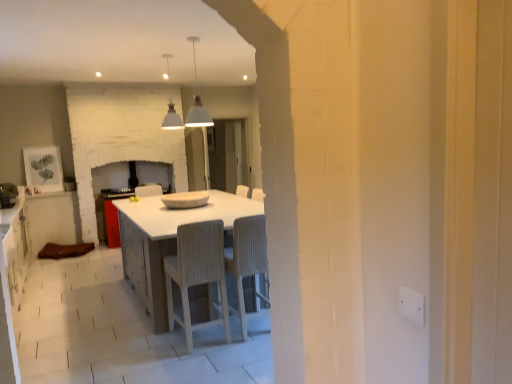
Image resolution: width=512 pixels, height=384 pixels. Describe the element at coordinates (411, 305) in the screenshot. I see `white plastic electric outlet at right` at that location.

In order to face white matte pendant lights at upper center, the first light fixture when ordered from right to left, should I rotate leftwards or rightwards?

It's best to rotate left around 7.794 degrees.

This screenshot has width=512, height=384. What do you see at coordinates (8, 195) in the screenshot?
I see `brushed metal oven at left` at bounding box center [8, 195].

The image size is (512, 384). What are the coordinates of `white glossy table at center` in the screenshot? It's located at (166, 241).

Describe the element at coordinates (52, 220) in the screenshot. I see `matte brown cabinet at left` at that location.

This screenshot has height=384, width=512. I want to click on velvet beige armchair at center, so click(151, 184).

How far apart are white matte pendant lights at upper center, which is the 2th light fixture from left to right, and white ribbed chair at center, the first chair in the left-to-right sequence?

white matte pendant lights at upper center, which is the 2th light fixture from left to right, is 1.47 meters from white ribbed chair at center, the first chair in the left-to-right sequence.

Is white matte pendant lights at upper center, the first light fixture when ordered from right to left, wider than white ribbed chair at center, placed as the second chair when sorted from right to left?

No.

Is white matte pendant lights at upper center, marked as the second light fixture in a back-to-front arrangement, located outside white ribbed chair at center, the first chair in the left-to-right sequence?

That's correct, white matte pendant lights at upper center, marked as the second light fixture in a back-to-front arrangement, is outside of white ribbed chair at center, the first chair in the left-to-right sequence.

Would you say white matte pendant lights at upper center, which is the 1th light fixture from front to back, is to the left or to the right of white ribbed chair at center, the first chair in the left-to-right sequence, in the picture?

white matte pendant lights at upper center, which is the 1th light fixture from front to back, is positioned on white ribbed chair at center, the first chair in the left-to-right sequence,'s left side.

Could you tell me if white glossy table at center is facing white textured chair at center, the second chair from the left?

No, white glossy table at center is not turned towards white textured chair at center, the second chair from the left.

Which object is further away from the camera, white glossy table at center or white textured chair at center, marked as the first chair in a right-to-left arrangement?

white textured chair at center, marked as the first chair in a right-to-left arrangement, is more distant.

From the image's perspective, would you say white glossy table at center is shown under white textured chair at center, marked as the first chair in a right-to-left arrangement?

Incorrect, from the image's perspective, white glossy table at center is higher than white textured chair at center, marked as the first chair in a right-to-left arrangement.

Which is less distant, [170,232] or [260,259]?

Point [170,232] is positioned closer to the camera compared to point [260,259].

Locate an element on the screen. Image resolution: width=512 pixels, height=384 pixels. appliance lying behind the white textured chair at center, the second chair from the left is located at coordinates (8, 195).

From the image's perspective, would you say white textured chair at center, marked as the first chair in a right-to-left arrangement, is positioned over brushed metal oven at left?

Actually, white textured chair at center, marked as the first chair in a right-to-left arrangement, appears below brushed metal oven at left in the image.

Which is further, [250,217] or [14,188]?

The point [14,188] is farther from the camera.

In the scene shown: How different are the orientations of white ribbed chair at center, placed as the second chair when sorted from right to left, and matte brown cabinet at left in degrees?

The facing directions of white ribbed chair at center, placed as the second chair when sorted from right to left, and matte brown cabinet at left are 180 degrees apart.

Is white ribbed chair at center, the first chair in the left-to-right sequence, oriented away from matte brown cabinet at left?

No.

Do you think white ribbed chair at center, the first chair in the left-to-right sequence, is within matte brown cabinet at left, or outside of it?

white ribbed chair at center, the first chair in the left-to-right sequence, is outside matte brown cabinet at left.

Is there a large distance between white ribbed chair at center, placed as the second chair when sorted from right to left, and matte brown cabinet at left?

white ribbed chair at center, placed as the second chair when sorted from right to left, is positioned a significant distance from matte brown cabinet at left.

Is white textured chair at center, marked as the first chair in a right-to-left arrangement, placed right next to velvet beige armchair at center?

white textured chair at center, marked as the first chair in a right-to-left arrangement, is not next to velvet beige armchair at center, and they're not touching.

Considering the positions of point (229, 271) and point (158, 183), is point (229, 271) closer or farther from the camera than point (158, 183)?

Point (229, 271).

From the image's perspective, relative to velvet beige armchair at center, is white textured chair at center, marked as the first chair in a right-to-left arrangement, above or below?

white textured chair at center, marked as the first chair in a right-to-left arrangement, is below velvet beige armchair at center.

Can you confirm if white glossy table at center is taller than velvet beige armchair at center?

Correct, white glossy table at center is much taller as velvet beige armchair at center.

Between white glossy table at center and velvet beige armchair at center, which one has smaller size?

With smaller size is velvet beige armchair at center.

From the image's perspective, which one is positioned lower, white glossy table at center or velvet beige armchair at center?

white glossy table at center is shown below in the image.

Is point (176, 242) positioned in front of point (151, 183)?

Yes, it is in front of point (151, 183).

How far apart are white textured chair at center, the second chair from the left, and white glossy table at center?

white textured chair at center, the second chair from the left, is 28.23 inches from white glossy table at center.

Does white textured chair at center, marked as the first chair in a right-to-left arrangement, turn towards white glossy table at center?

Yes, white textured chair at center, marked as the first chair in a right-to-left arrangement, is aimed at white glossy table at center.

Is the surface of white textured chair at center, the second chair from the left, in direct contact with white glossy table at center?

No.

Who is smaller, white textured chair at center, the second chair from the left, or white glossy table at center?

Smaller between the two is white textured chair at center, the second chair from the left.

Where is `the 1st chair counting from the right side of the white matte pendant lights at upper center, marked as the second light fixture in a back-to-front arrangement`? the 1st chair counting from the right side of the white matte pendant lights at upper center, marked as the second light fixture in a back-to-front arrangement is located at coordinates (197, 272).

Where is `table that is in front of the white textured chair at center, the second chair from the left`? The width and height of the screenshot is (512, 384). table that is in front of the white textured chair at center, the second chair from the left is located at coordinates (166, 241).

Based on their spatial positions, is brushed metal oven at left or white matte pendant light at upper center, the 1th light fixture when ordered from back to front, further from white glossy table at center?

brushed metal oven at left.

Considering their positions, is white ribbed chair at center, the first chair in the left-to-right sequence, positioned closer to white textured chair at center, marked as the first chair in a right-to-left arrangement, than white matte pendant lights at upper center, marked as the second light fixture in a back-to-front arrangement?

white ribbed chair at center, the first chair in the left-to-right sequence, is positioned closer to the anchor white textured chair at center, marked as the first chair in a right-to-left arrangement.

From the image, which object appears to be farther from white plastic electric outlet at right, white textured chair at center, marked as the first chair in a right-to-left arrangement, or white matte pendant light at upper center, arranged as the second light fixture when viewed from the front?

white matte pendant light at upper center, arranged as the second light fixture when viewed from the front, is positioned further to the anchor white plastic electric outlet at right.

From the image, which object appears to be farther from white ribbed chair at center, placed as the second chair when sorted from right to left, white textured chair at center, marked as the first chair in a right-to-left arrangement, or matte brown cabinet at left?

matte brown cabinet at left is further to white ribbed chair at center, placed as the second chair when sorted from right to left.

Which object lies nearer to the anchor point white plastic electric outlet at right, brushed metal oven at left or white textured chair at center, the second chair from the left?

white textured chair at center, the second chair from the left.

From the image, which object appears to be nearer to white matte pendant light at upper center, the 1th light fixture when ordered from back to front, white ribbed chair at center, placed as the second chair when sorted from right to left, or matte brown cabinet at left?

The object closer to white matte pendant light at upper center, the 1th light fixture when ordered from back to front, is white ribbed chair at center, placed as the second chair when sorted from right to left.

From the image, which object appears to be farther from matte brown cabinet at left, white ribbed chair at center, the first chair in the left-to-right sequence, or white matte pendant light at upper center, which is the 2th light fixture in right-to-left order?

Among the two, white ribbed chair at center, the first chair in the left-to-right sequence, is located further to matte brown cabinet at left.

Estimate the real-world distances between objects in this image. Which object is further from white glossy table at center, white plastic electric outlet at right or white textured chair at center, marked as the first chair in a right-to-left arrangement?

Among the two, white plastic electric outlet at right is located further to white glossy table at center.

You are a GUI agent. You are given a task and a screenshot of the screen. Output one action in this format:
    pyautogui.click(x=<x>, y=<y>)
    Task: Click on the cabinetry located between brushed metal oven at left and white textured chair at center, the second chair from the left, in the left-right direction
    
    Given the screenshot: What is the action you would take?
    pyautogui.click(x=52, y=220)

Identify the location of chair between white plastic electric outlet at right and white glossy table at center in the front-back direction. (197, 272).

Where is `cabinetry positioned between white textured chair at center, the second chair from the left, and velvet beige armchair at center from near to far`? Image resolution: width=512 pixels, height=384 pixels. cabinetry positioned between white textured chair at center, the second chair from the left, and velvet beige armchair at center from near to far is located at coordinates (52, 220).

Locate an element on the screen. Image resolution: width=512 pixels, height=384 pixels. appliance between white ribbed chair at center, placed as the second chair when sorted from right to left, and matte brown cabinet at left, along the z-axis is located at coordinates (8, 195).